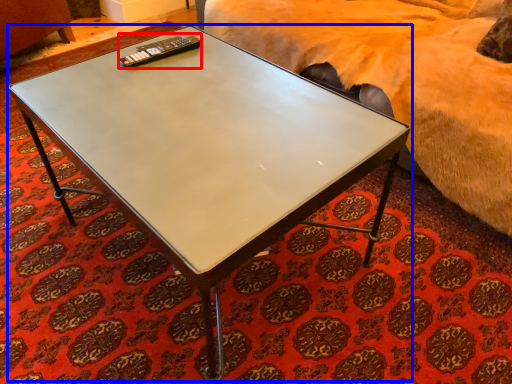
Question: Which point is further to the camera, remote (highlighted by a red box) or coffee table (highlighted by a blue box)?

Choices:
 (A) remote
 (B) coffee table

Answer: (A)